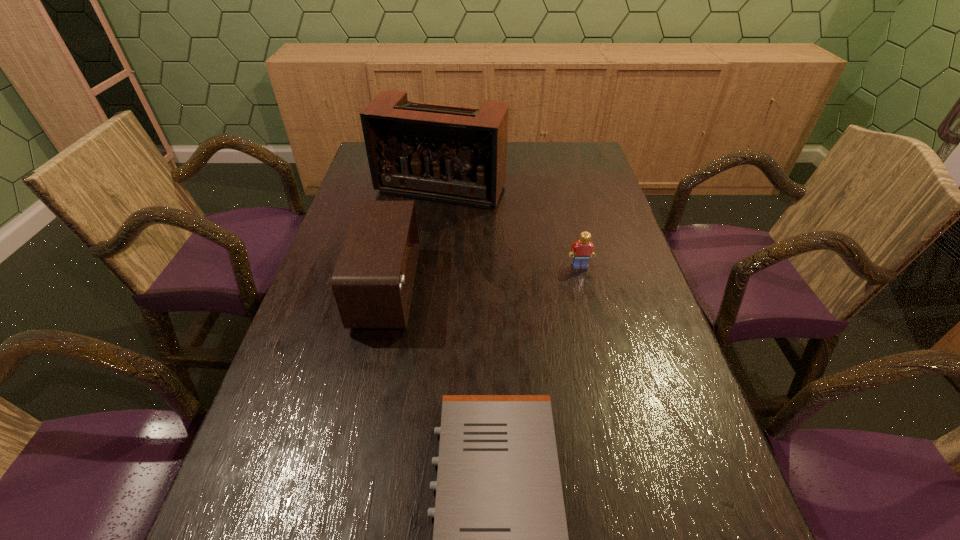
Locate an element on the screen. This screenshot has height=540, width=960. the tallest radio receiver is located at coordinates (452, 154).

Locate an element on the screen. The width and height of the screenshot is (960, 540). the tallest object is located at coordinates (452, 154).

Image resolution: width=960 pixels, height=540 pixels. Find the location of `the third shortest object`. the third shortest object is located at coordinates (373, 280).

Where is `the second shortest radio receiver`? the second shortest radio receiver is located at coordinates (373, 280).

Locate an element on the screen. The image size is (960, 540). the second shortest object is located at coordinates (581, 251).

Where is `Lego`? Lego is located at coordinates click(x=581, y=251).

Locate an element on the screen. This screenshot has height=540, width=960. free space located 0.380m on the front of the tallest object is located at coordinates coord(427,305).

Find the location of a particular element. vacant space located on the front-facing side of the second farthest radio receiver is located at coordinates (447, 288).

You are a GUI agent. You are given a task and a screenshot of the screen. Output one action in this format:
    pyautogui.click(x=<x>, y=<y>)
    Task: Click on the vacant space located 0.340m on the front-facing side of the rightmost object
    The width and height of the screenshot is (960, 540).
    Given the screenshot: What is the action you would take?
    pyautogui.click(x=610, y=383)

What are the coordinates of `object positioned at the far edge` in the screenshot? It's located at (452, 154).